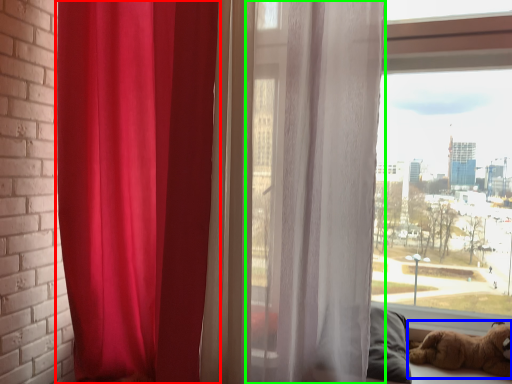
Question: Based on their relative distances, which object is nearer to curtain (highlighted by a red box)? Choose from dog (highlighted by a blue box) and curtain (highlighted by a green box).

Choices:
 (A) dog
 (B) curtain

Answer: (B)